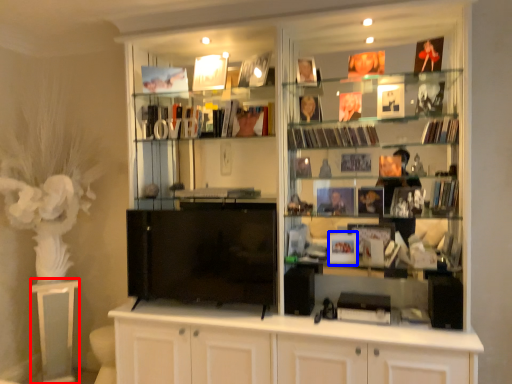
Question: Which point is closer to the camera, table (highlighted by a red box) or book (highlighted by a blue box)?

Choices:
 (A) table
 (B) book

Answer: (B)